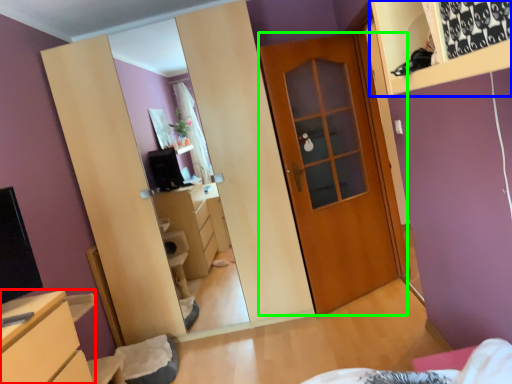
Question: Based on their relative distances, which object is farther from chest of drawers (highlighted by a red box)? Choose from shelf (highlighted by a blue box) and door (highlighted by a green box).

Choices:
 (A) shelf
 (B) door

Answer: (B)